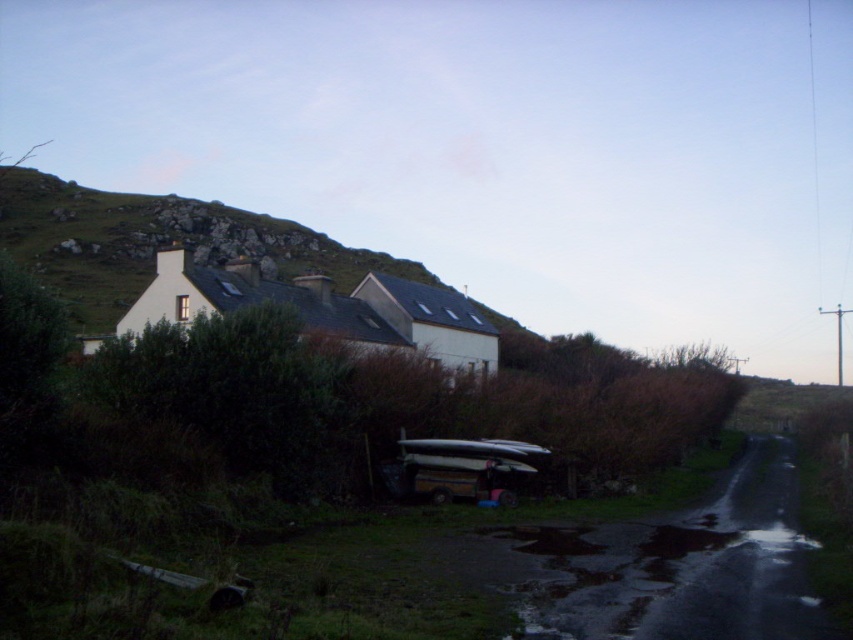
Question: Which point is farther from the camera taking this photo?

Choices:
 (A) (434, 461)
 (B) (136, 196)

Answer: (B)

Question: Where is green grassy hillside at upper left located in relation to metallic silver canoe at center in the image?

Choices:
 (A) right
 (B) left

Answer: (B)

Question: Can you confirm if green grassy hillside at upper left is wider than metallic silver canoe at center?

Choices:
 (A) no
 (B) yes

Answer: (B)

Question: From the image, what is the correct spatial relationship of green grassy hillside at upper left in relation to metallic silver canoe at center?

Choices:
 (A) right
 (B) left

Answer: (B)

Question: Which point is closer to the camera?

Choices:
 (A) green grassy hillside at upper left
 (B) metallic silver canoe at center

Answer: (B)

Question: Which object appears closest to the camera in this image?

Choices:
 (A) metallic silver canoe at center
 (B) green grassy hillside at upper left

Answer: (A)